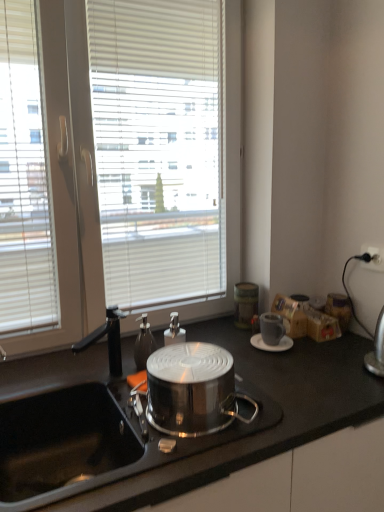
This screenshot has height=512, width=384. I want to click on vacant space situated above black matte countertop at center (from a real-world perspective), so click(x=235, y=370).